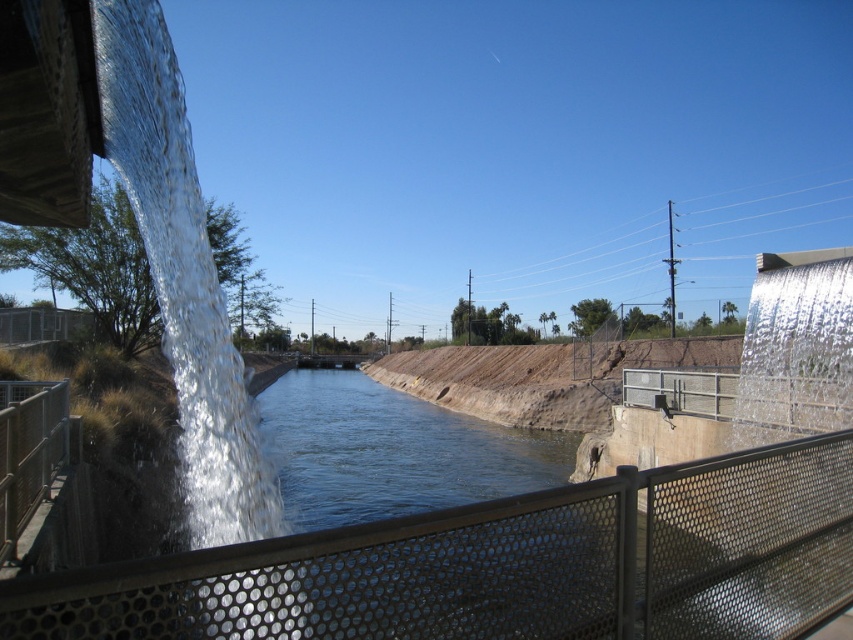
You are a safety inspector evaluating the canal structures. The safety guidelines require that the taller metal mesh fence must be placed where the water flow is more vigorous to prevent accidents. Based on the scene description, is the current placement of the metal mesh fence at center and metal mesh fence at left compliant with the guidelines?

The metal mesh fence at center is taller than metal mesh fence at left. According to the scene description, the water on the left side is flowing more vigorously with misty spray. Since the taller fence is not placed where the water flow is more vigorous, the current placement does not comply with the guidelines.

You are a visitor standing at the edge of the canal and see both the metal mesh fence at center and the metal mesh fence at left. Which fence is closer to you?

The metal mesh fence at center is closer to you because it is in front of the metal mesh fence at left.